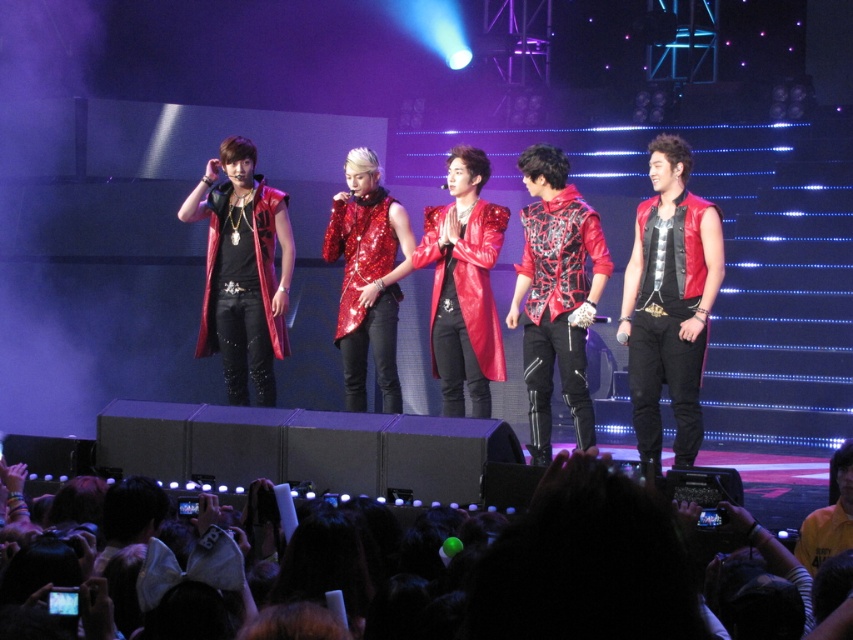
You are a stagehand holding a ladder that is 2 meters long. You need to place the ladder between the shiny red vest at right and the black fabric crowd at lower center so that performers can access the stage lights. Will the ladder reach from one to the other?

The distance between the shiny red vest at right and the black fabric crowd at lower center is 2.73 meters. Since the ladder is only 2 meters long, it will not be long enough to span the gap between them.

You are a photographer trying to capture the performer holding the microphone. You notice two points marked on your camera screen at coordinates point (x=700, y=275) and point (x=840, y=474). Which point is closer to the camera lens?

Point (x=700, y=275) is further to the camera than point (x=840, y=474). Wait, the description says the opposite. Let me check again. The Objects Description states that point (x=700, y=275) is further to the camera than point (x=840, y=474). Therefore, the closer point to the camera lens would be point (x=840, y=474).